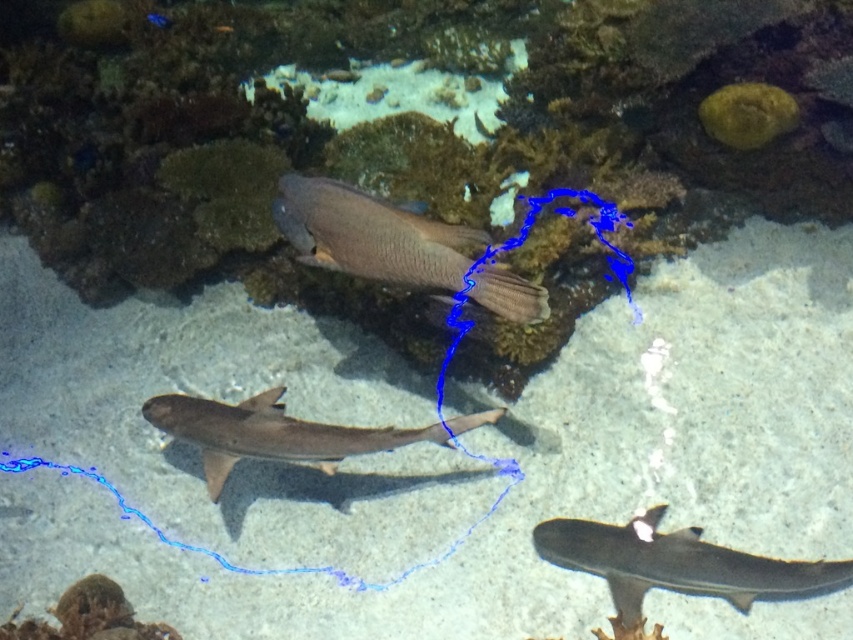
Question: Can you confirm if smooth gray shark at lower right is positioned above smooth gray shark at center?

Choices:
 (A) yes
 (B) no

Answer: (B)

Question: Considering the relative positions of matte brown fish at center and smooth gray shark at lower right in the image provided, where is matte brown fish at center located with respect to smooth gray shark at lower right?

Choices:
 (A) left
 (B) right

Answer: (A)

Question: Based on their relative distances, which object is nearer to the smooth gray shark at center?

Choices:
 (A) matte brown fish at center
 (B) smooth gray shark at lower right

Answer: (A)

Question: Which object is farther from the camera taking this photo?

Choices:
 (A) smooth gray shark at lower right
 (B) smooth gray shark at center

Answer: (B)

Question: Is matte brown fish at center thinner than smooth gray shark at center?

Choices:
 (A) no
 (B) yes

Answer: (B)

Question: Which point is farther to the camera?

Choices:
 (A) smooth gray shark at center
 (B) smooth gray shark at lower right
 (C) matte brown fish at center

Answer: (A)